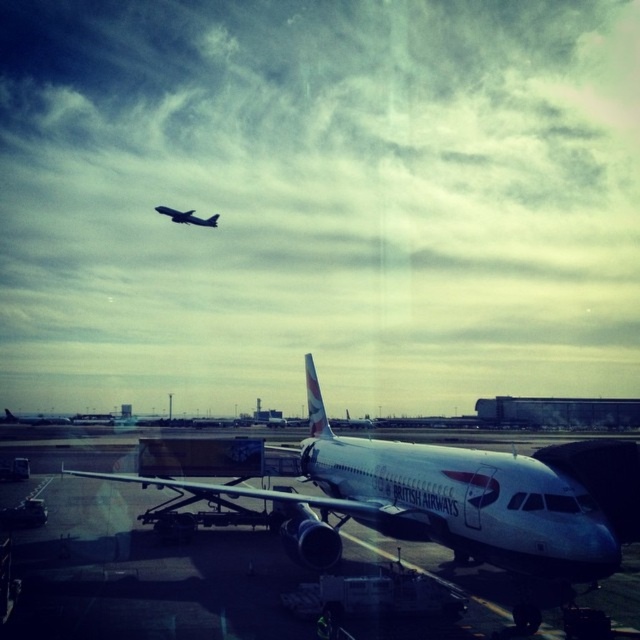
Between silver metallic airplane at center and metallic silver airplane at upper center, which one appears on the right side from the viewer's perspective?

silver metallic airplane at center is more to the right.

Which is behind, point (637, 470) or point (188, 218)?

The point (188, 218) is behind.

Is point (477, 493) positioned in front of point (177, 212)?

Yes, point (477, 493) is closer to viewer.

Where is `silver metallic airplane at center`? silver metallic airplane at center is located at coordinates (452, 497).